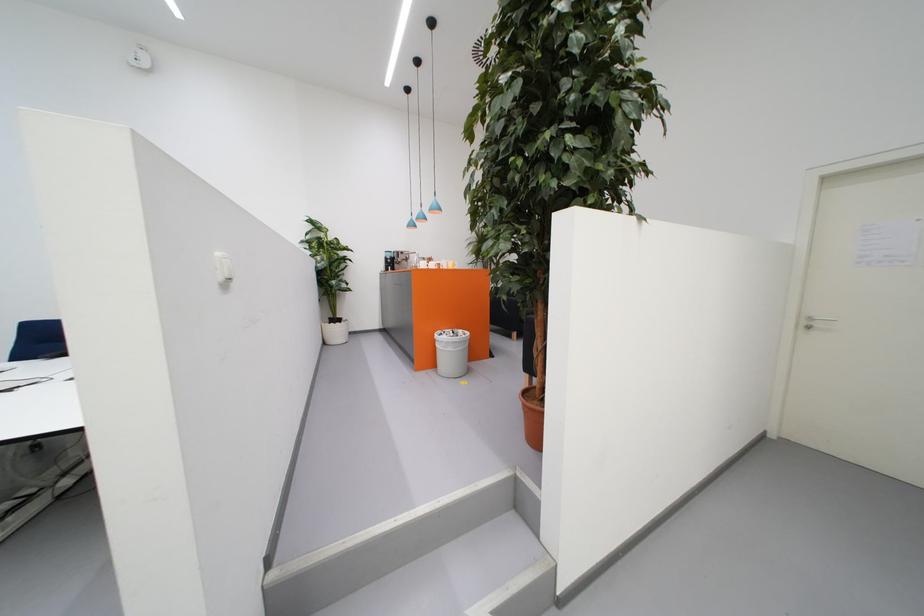
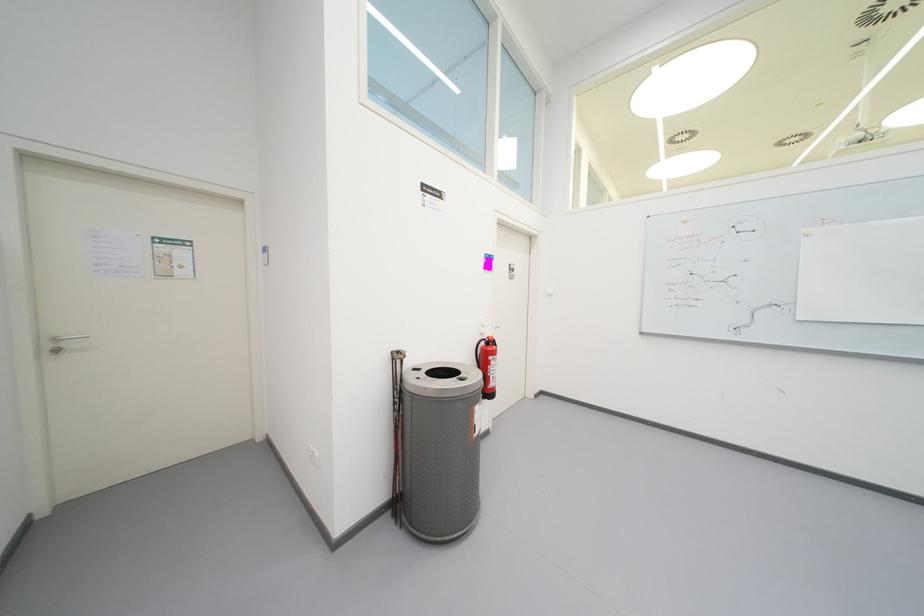
Question: Based on the continuous images, in which direction is the camera rotating? Reply with the corresponding letter.

Choices:
 (A) Left
 (B) Right
 (C) Up
 (D) Down

Answer: (B)